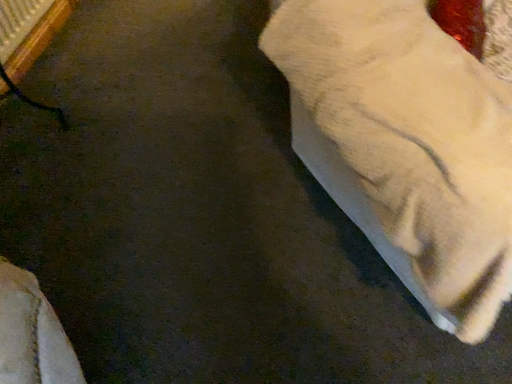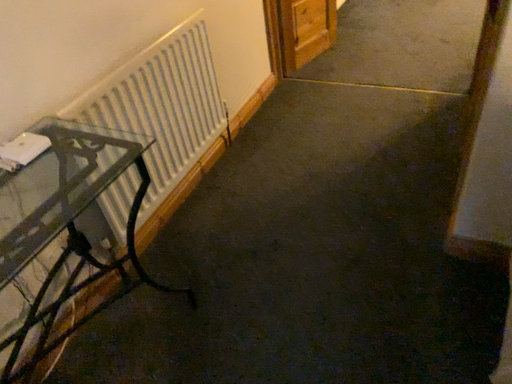
Question: How did the camera likely rotate when shooting the video?

Choices:
 (A) rotated right
 (B) rotated left

Answer: (B)